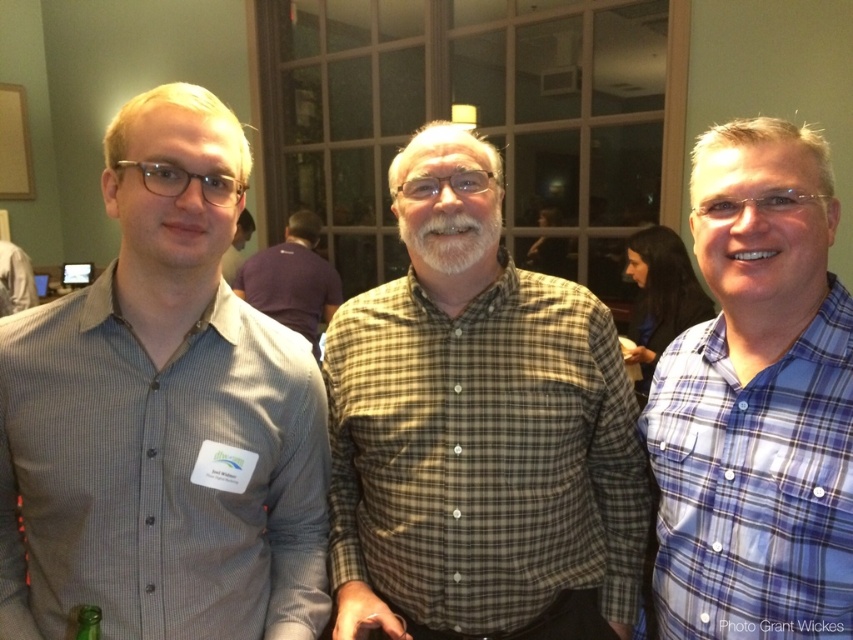
Question: Can you confirm if plaid shirt at center is positioned above green glass bottle at lower left?

Choices:
 (A) no
 (B) yes

Answer: (B)

Question: Which object appears farthest from the camera in this image?

Choices:
 (A) blue plaid shirt at right
 (B) plaid shirt at center

Answer: (B)

Question: Where is brown plaid shirt at center located in relation to plaid shirt at center in the image?

Choices:
 (A) above
 (B) below

Answer: (B)

Question: In this image, where is brown plaid shirt at center located relative to blue plaid shirt at right?

Choices:
 (A) below
 (B) above

Answer: (A)

Question: Among these objects, which one is nearest to the camera?

Choices:
 (A) blue plaid shirt at right
 (B) gray button-down shirt at left

Answer: (A)

Question: Which object appears closest to the camera in this image?

Choices:
 (A) gray button-down shirt at left
 (B) plaid shirt at center
 (C) green glass bottle at lower left

Answer: (C)